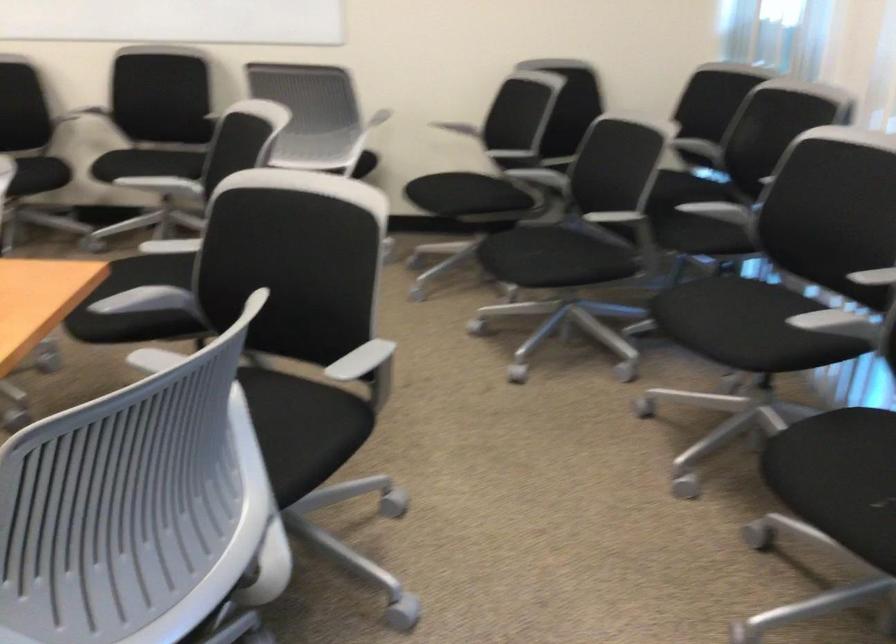
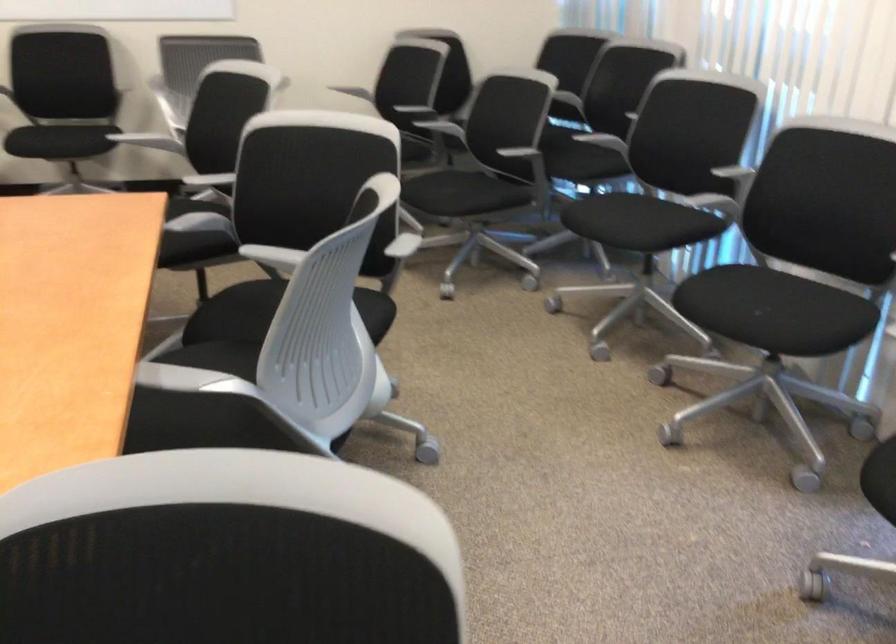
Find the pixel in the second image that matches point 726,327 in the first image.

(624, 221)